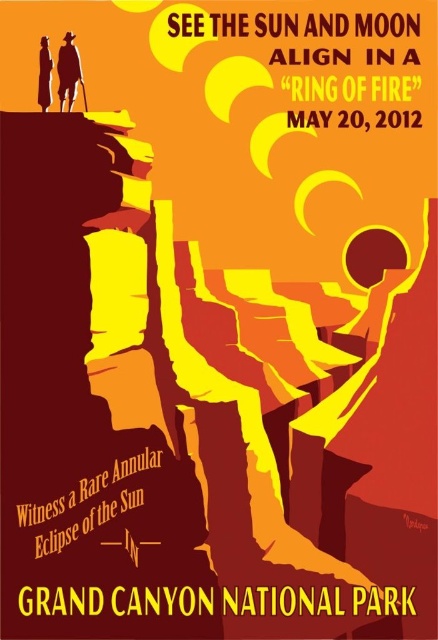
You are designing a promotional poster for an event and need to place a matte brown hat at upper left and a vintage camera at lower right. The poster has a width of 2 meters. According to the design guidelines, objects must be at least 0.5 meters apart. Do these placements meet the requirement?

The matte brown hat at upper left and vintage camera at lower right are 19.67 meters apart, so yes, the placements meet the requirement as they are more than 0.5 meters apart.

What is the relationship between the size of the matte brown hat at upper left and the matte black figure at upper left in the image?

The matte brown hat at upper left occupies less space than the matte black figure at upper left.

Based on the photo, you are designing a poster and need to ensure that the matte brown hat at upper left and the matte black figure at upper left are positioned correctly. According to the design guidelines, the hat should be placed above the figure. Is the current arrangement in the poster following the guidelines?

Yes, the matte brown hat at upper left is located above the matte black figure at upper left, so the current arrangement follows the design guidelines.